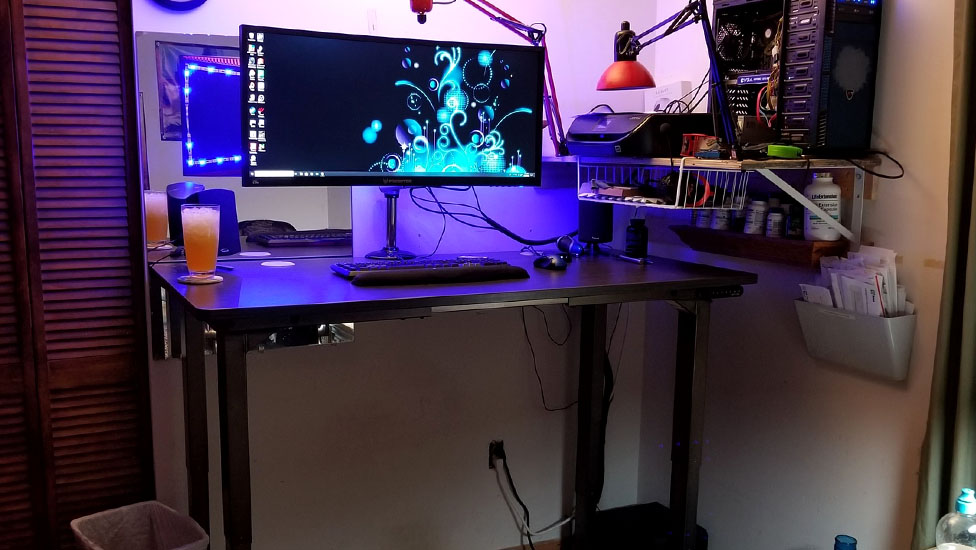
Locate an element on the screen. The width and height of the screenshot is (976, 550). mouse is located at coordinates (560, 258).